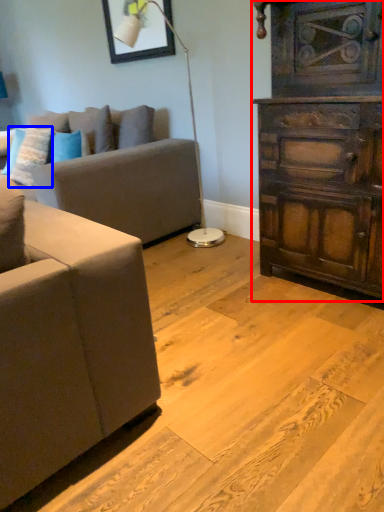
Question: Which object appears farthest to the camera in this image, chest of drawers (highlighted by a red box) or pillow (highlighted by a blue box)?

Choices:
 (A) chest of drawers
 (B) pillow

Answer: (B)